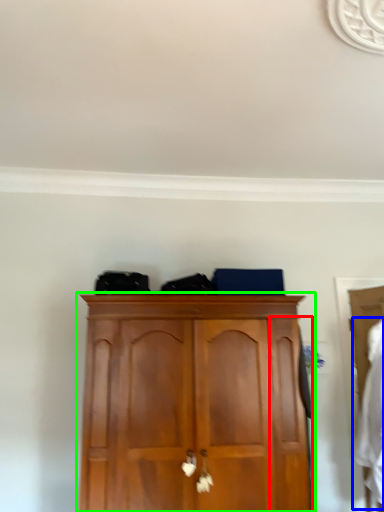
Question: Which object is the closest to the door (highlighted by a red box)? Choose among these: clothing (highlighted by a blue box) or cupboard (highlighted by a green box).

Choices:
 (A) clothing
 (B) cupboard

Answer: (B)